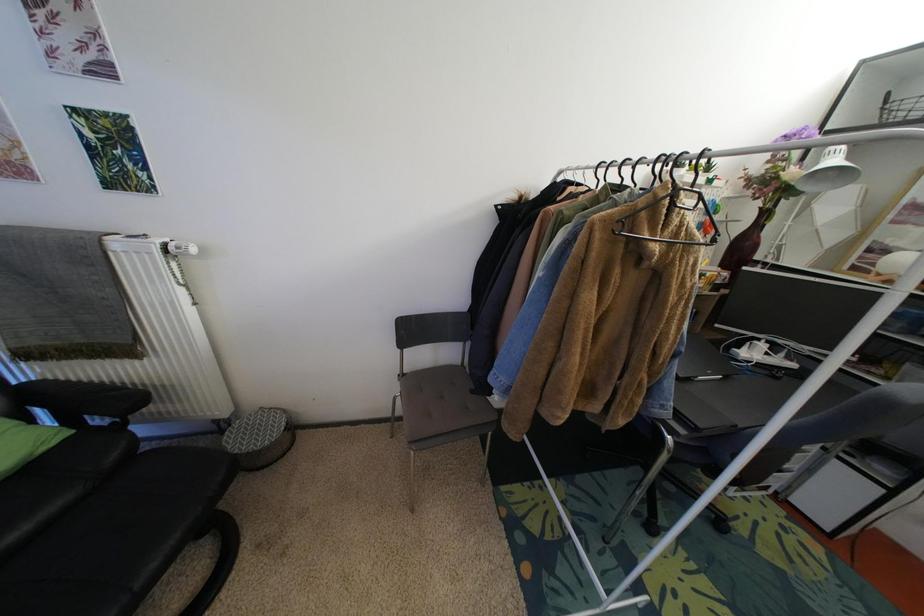
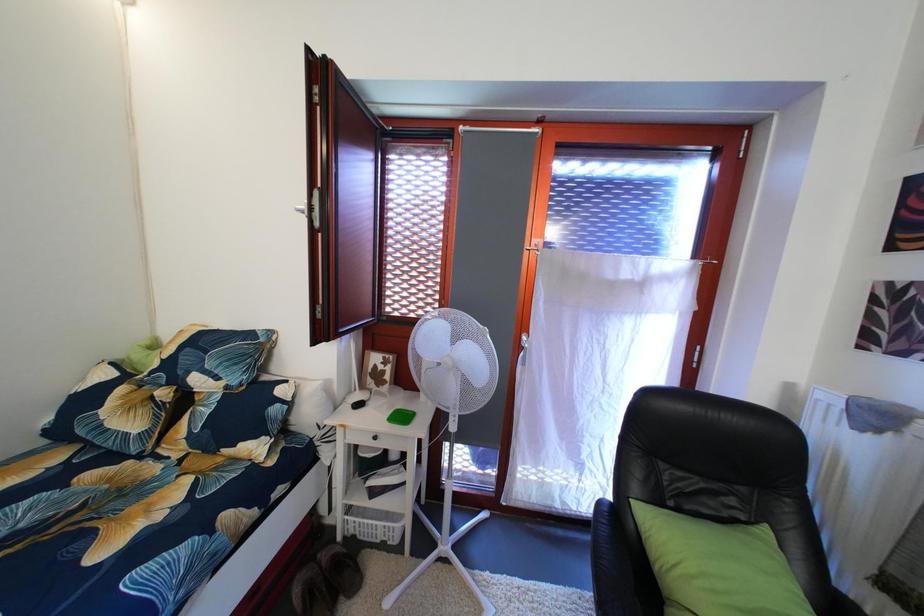
Question: The camera is either moving clockwise (left) or counter-clockwise (right) around the object. The first image is from the beginning of the video and the second image is from the end. Is the camera moving left or right when shooting the video?

Choices:
 (A) Left
 (B) Right

Answer: (B)